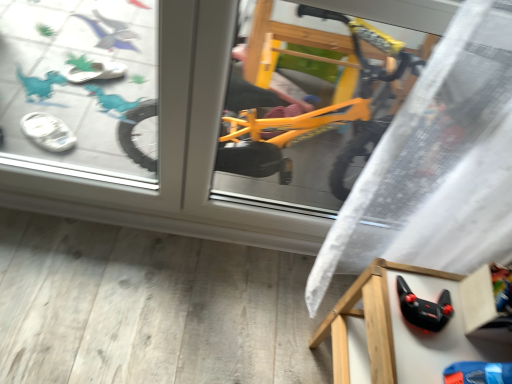
What do you see at coordinates (397, 330) in the screenshot?
I see `black plastic game controller at lower right` at bounding box center [397, 330].

At what (x,y) coordinates should I click in order to perform the action: click on black plastic game controller at lower right. Please return your answer as a coordinate pair (x, y). This screenshot has width=512, height=384. Looking at the image, I should click on (397, 330).

You are a GUI agent. You are given a task and a screenshot of the screen. Output one action in this format:
    pyautogui.click(x=<x>, y=<y>)
    Task: Click on the black plastic game controller at lower right
    
    Given the screenshot: What is the action you would take?
    pyautogui.click(x=397, y=330)